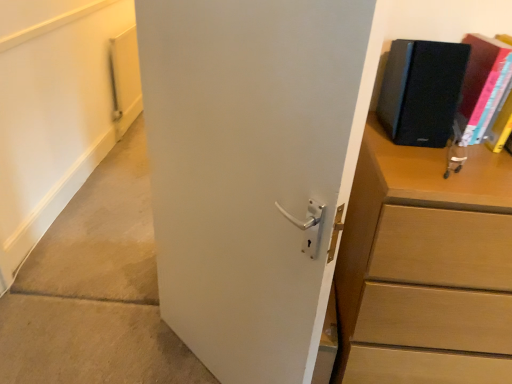
Describe the element at coordinates (421, 91) in the screenshot. I see `black matte speaker at upper right, which is the first paperback book from left to right` at that location.

Where is `matte black book at upper right, arranged as the second paperback book when viewed from the left`? The width and height of the screenshot is (512, 384). matte black book at upper right, arranged as the second paperback book when viewed from the left is located at coordinates (479, 81).

At what (x,y) coordinates should I click in order to perform the action: click on white matte door at center. Please return your answer as a coordinate pair (x, y). Looking at the image, I should click on (x=253, y=169).

Considering the points (307, 246) and (488, 58), which point is in front, point (307, 246) or point (488, 58)?

The point (307, 246) is closer to the camera.

Visually, is white matte door at center positioned to the left or to the right of matte black book at upper right, arranged as the 1th paperback book when viewed from the right?

Clearly, white matte door at center is on the left of matte black book at upper right, arranged as the 1th paperback book when viewed from the right, in the image.

Is white matte door at center facing away from matte black book at upper right, arranged as the second paperback book when viewed from the left?

Yes, white matte door at center is positioned with its back facing matte black book at upper right, arranged as the second paperback book when viewed from the left.

Between wooden chest of drawers at right and black matte speaker at upper right, which is the second paperback book from right to left, which one appears on the right side from the viewer's perspective?

Positioned to the right is wooden chest of drawers at right.

Can we say wooden chest of drawers at right lies outside black matte speaker at upper right, which is the first paperback book from left to right?

Yes, wooden chest of drawers at right is outside of black matte speaker at upper right, which is the first paperback book from left to right.

Does wooden chest of drawers at right turn towards black matte speaker at upper right, which is the second paperback book from right to left?

No, wooden chest of drawers at right is not turned towards black matte speaker at upper right, which is the second paperback book from right to left.

Based on the photo, which is more to the right, white matte door at center or black matte speaker at upper right, which is the second paperback book from right to left?

black matte speaker at upper right, which is the second paperback book from right to left, is more to the right.

From a real-world perspective, who is located higher, white matte door at center or black matte speaker at upper right, which is the second paperback book from right to left?

black matte speaker at upper right, which is the second paperback book from right to left, is physically above.

How many degrees apart are the facing directions of white matte door at center and black matte speaker at upper right, which is the first paperback book from left to right?

The angle between the facing direction of white matte door at center and the facing direction of black matte speaker at upper right, which is the first paperback book from left to right, is 44 degrees.

Is there a large distance between white matte door at center and black matte speaker at upper right, which is the second paperback book from right to left?

white matte door at center is near black matte speaker at upper right, which is the second paperback book from right to left, not far away.

In terms of size, does matte black book at upper right, arranged as the second paperback book when viewed from the left, appear bigger or smaller than black matte speaker at upper right, which is the second paperback book from right to left?

matte black book at upper right, arranged as the second paperback book when viewed from the left, is smaller than black matte speaker at upper right, which is the second paperback book from right to left.

The height and width of the screenshot is (384, 512). I want to click on paperback book below the black matte speaker at upper right, which is the first paperback book from left to right (from the image's perspective), so pos(479,81).

Is matte black book at upper right, arranged as the second paperback book when viewed from the left, inside or outside of black matte speaker at upper right, which is the second paperback book from right to left?

matte black book at upper right, arranged as the second paperback book when viewed from the left, is not inside black matte speaker at upper right, which is the second paperback book from right to left, it's outside.

In terms of width, does matte black book at upper right, arranged as the 1th paperback book when viewed from the right, look wider or thinner when compared to black matte speaker at upper right, which is the second paperback book from right to left?

Clearly, matte black book at upper right, arranged as the 1th paperback book when viewed from the right, has more width compared to black matte speaker at upper right, which is the second paperback book from right to left.

Is black matte speaker at upper right, which is the first paperback book from left to right, not inside white matte door at center?

Absolutely, black matte speaker at upper right, which is the first paperback book from left to right, is external to white matte door at center.

Which is nearer, (443,119) or (362,131)?

Point (443,119) is positioned closer to the camera compared to point (362,131).

From a real-world perspective, is black matte speaker at upper right, which is the second paperback book from right to left, below white matte door at center?

Actually, black matte speaker at upper right, which is the second paperback book from right to left, is physically above white matte door at center in the real world.

Locate an element on the screen. the 2nd paperback book positioned above the white matte door at center (from a real-world perspective) is located at coordinates (421, 91).

Is wooden chest of drawers at right situated inside matte black book at upper right, arranged as the second paperback book when viewed from the left, or outside?

wooden chest of drawers at right cannot be found inside matte black book at upper right, arranged as the second paperback book when viewed from the left.

Can you tell me how much wooden chest of drawers at right and matte black book at upper right, arranged as the 1th paperback book when viewed from the right, differ in facing direction?

There is a 0.315-degree angle between the facing directions of wooden chest of drawers at right and matte black book at upper right, arranged as the 1th paperback book when viewed from the right.

Which paperback book is the 1st one when counting from the left side of the wooden chest of drawers at right? Please provide its 2D coordinates.

[(479, 81)]

Does wooden chest of drawers at right have a greater height compared to matte black book at upper right, arranged as the 1th paperback book when viewed from the right?

Yes.

Is wooden chest of drawers at right spatially inside white matte door at center, or outside of it?

wooden chest of drawers at right lies outside white matte door at center.

Which object is further away from the camera, wooden chest of drawers at right or white matte door at center?

wooden chest of drawers at right is more distant.

Based on the photo, does wooden chest of drawers at right have a lesser height compared to white matte door at center?

Yes, wooden chest of drawers at right is shorter than white matte door at center.

Is wooden chest of drawers at right at the left side of white matte door at center?

Incorrect, wooden chest of drawers at right is not on the left side of white matte door at center.

Where is `the 2nd paperback book to the right when counting from the white matte door at center`? The width and height of the screenshot is (512, 384). the 2nd paperback book to the right when counting from the white matte door at center is located at coordinates (479, 81).

What are the coordinates of `the chest of drawers below the black matte speaker at upper right, which is the second paperback book from right to left (from the image's perspective)` in the screenshot? It's located at (425, 267).

Considering their positions, is wooden chest of drawers at right positioned further to black matte speaker at upper right, which is the first paperback book from left to right, than matte black book at upper right, arranged as the second paperback book when viewed from the left?

Among the two, wooden chest of drawers at right is located further to black matte speaker at upper right, which is the first paperback book from left to right.

Which object lies nearer to the anchor point wooden chest of drawers at right, matte black book at upper right, arranged as the second paperback book when viewed from the left, or white matte door at center?

white matte door at center lies closer to wooden chest of drawers at right than the other object.

Estimate the real-world distances between objects in this image. Which object is further from white matte door at center, wooden chest of drawers at right or matte black book at upper right, arranged as the 1th paperback book when viewed from the right?

matte black book at upper right, arranged as the 1th paperback book when viewed from the right, is further to white matte door at center.

Estimate the real-world distances between objects in this image. Which object is further from wooden chest of drawers at right, white matte door at center or black matte speaker at upper right, which is the first paperback book from left to right?

The object further to wooden chest of drawers at right is white matte door at center.

Estimate the real-world distances between objects in this image. Which object is further from wooden chest of drawers at right, white matte door at center or matte black book at upper right, arranged as the 1th paperback book when viewed from the right?

matte black book at upper right, arranged as the 1th paperback book when viewed from the right, is positioned further to the anchor wooden chest of drawers at right.

Which object lies further to the anchor point wooden chest of drawers at right, black matte speaker at upper right, which is the second paperback book from right to left, or white matte door at center?

white matte door at center lies further to wooden chest of drawers at right than the other object.

Which object lies further to the anchor point matte black book at upper right, arranged as the 1th paperback book when viewed from the right, wooden chest of drawers at right or black matte speaker at upper right, which is the second paperback book from right to left?

wooden chest of drawers at right is further to matte black book at upper right, arranged as the 1th paperback book when viewed from the right.

Based on their spatial positions, is matte black book at upper right, arranged as the 1th paperback book when viewed from the right, or black matte speaker at upper right, which is the second paperback book from right to left, closer to white matte door at center?

Among the two, black matte speaker at upper right, which is the second paperback book from right to left, is located nearer to white matte door at center.

The height and width of the screenshot is (384, 512). In order to click on paperback book located between white matte door at center and matte black book at upper right, arranged as the second paperback book when viewed from the left, in the left-right direction in this screenshot , I will do `click(421, 91)`.

Where is `paperback book between black matte speaker at upper right, which is the second paperback book from right to left, and wooden chest of drawers at right from top to bottom`? paperback book between black matte speaker at upper right, which is the second paperback book from right to left, and wooden chest of drawers at right from top to bottom is located at coordinates (479, 81).